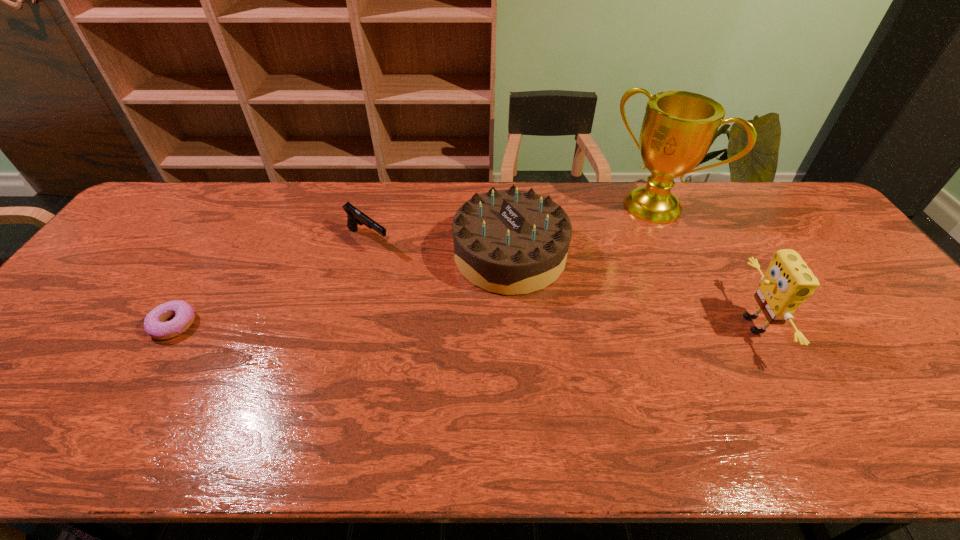
The height and width of the screenshot is (540, 960). I want to click on vacant space on the desktop that is between the shortest object and the sponge and is positioned on the front-facing side of the birthday cake, so click(421, 325).

This screenshot has width=960, height=540. In order to click on free space on the desktop that is between the shortest object and the second tallest object and is positioned at the aiming end of the fourth tallest object in this screenshot , I will do `click(481, 325)`.

You are a GUI agent. You are given a task and a screenshot of the screen. Output one action in this format:
    pyautogui.click(x=<x>, y=<y>)
    Task: Click on the vacant spot on the desktop that is between the leftmost object and the second tallest object and is positioned on the shiny surface of the award
    
    Given the screenshot: What is the action you would take?
    pyautogui.click(x=546, y=325)